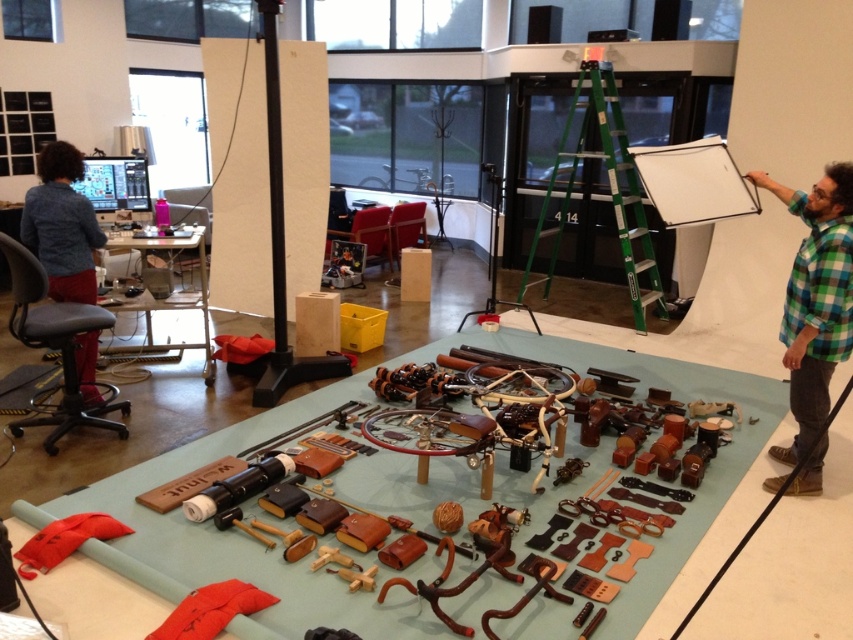
Between green metallic ladder at upper center and blue denim shirt at left, which one appears on the right side from the viewer's perspective?

green metallic ladder at upper center is more to the right.

Between green metallic ladder at upper center and blue denim shirt at left, which one has less height?

blue denim shirt at left

Who is more forward, (543, 236) or (84, 253)?

→ Point (84, 253) is in front.

What are the coordinates of `green metallic ladder at upper center` in the screenshot? It's located at (608, 186).

Is green plaid shirt at right to the right of green metallic ladder at upper center from the viewer's perspective?

Correct, you'll find green plaid shirt at right to the right of green metallic ladder at upper center.

Locate an element on the screen. The height and width of the screenshot is (640, 853). green plaid shirt at right is located at coordinates (815, 298).

Is point (793, 448) in front of point (641, 246)?

Yes, it is in front of point (641, 246).

You are a GUI agent. You are given a task and a screenshot of the screen. Output one action in this format:
    pyautogui.click(x=<x>, y=<y>)
    Task: Click on the green plaid shirt at right
    
    Given the screenshot: What is the action you would take?
    pyautogui.click(x=815, y=298)

The image size is (853, 640). I want to click on green plaid shirt at right, so click(x=815, y=298).

Where is `green plaid shirt at right`? This screenshot has height=640, width=853. green plaid shirt at right is located at coordinates click(815, 298).